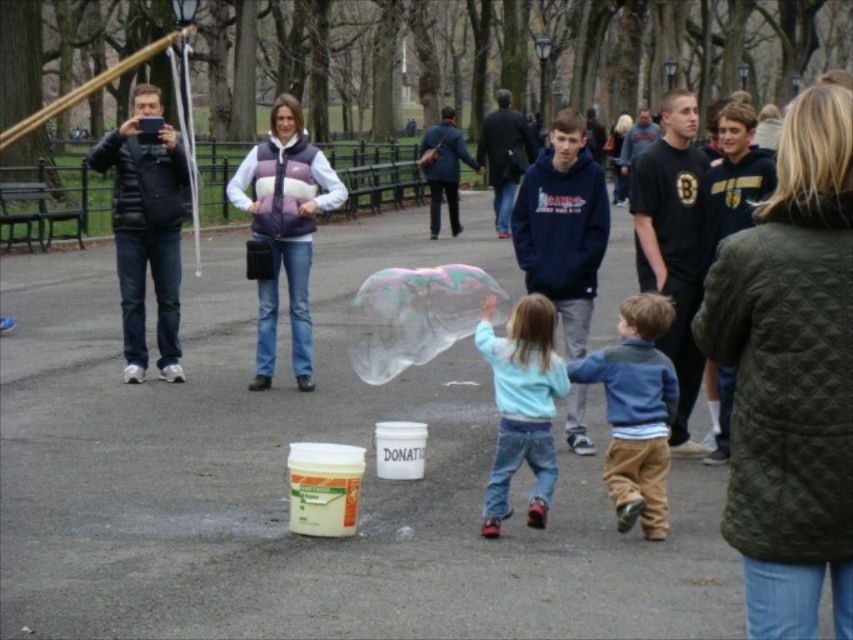
You are standing in the park and want to reach the point marked at coordinates (589, 356). If your walking speed is 1.5 meters per second, how many seconds will it take you to reach that point?

The distance to the point is 6.97 meters. At a speed of 1.5 meters per second, it will take approximately 4.65 seconds to reach the point.